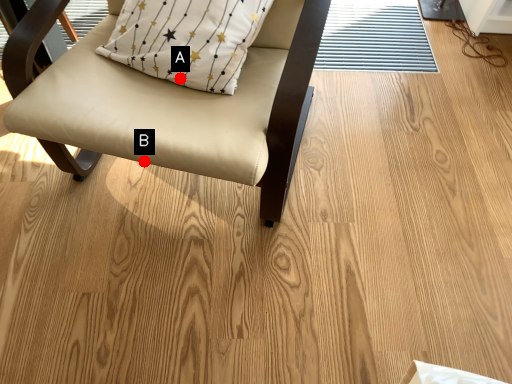
Question: Two points are circled on the image, labeled by A and B beside each circle. Which point is farther from the camera taking this photo?

Choices:
 (A) A is further
 (B) B is further

Answer: (A)